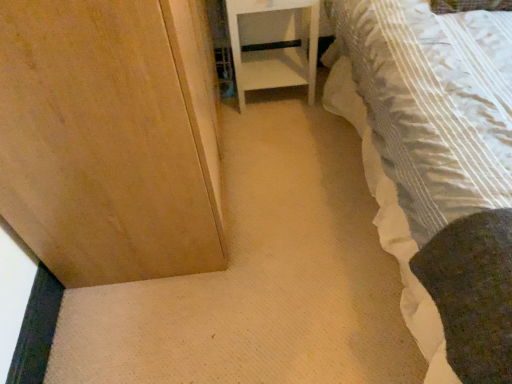
Question: Does white striped fabric bed at lower right have a greater height compared to white glossy nightstand at center?

Choices:
 (A) yes
 (B) no

Answer: (A)

Question: Can you confirm if white striped fabric bed at lower right is wider than white glossy nightstand at center?

Choices:
 (A) yes
 (B) no

Answer: (A)

Question: Is white striped fabric bed at lower right far away from white glossy nightstand at center?

Choices:
 (A) yes
 (B) no

Answer: (B)

Question: Is the position of white striped fabric bed at lower right more distant than that of white glossy nightstand at center?

Choices:
 (A) no
 (B) yes

Answer: (A)

Question: Does white striped fabric bed at lower right have a lesser width compared to white glossy nightstand at center?

Choices:
 (A) yes
 (B) no

Answer: (B)

Question: Can you confirm if white striped fabric bed at lower right is smaller than white glossy nightstand at center?

Choices:
 (A) yes
 (B) no

Answer: (B)

Question: Does white glossy nightstand at center have a greater width compared to white striped fabric bed at lower right?

Choices:
 (A) no
 (B) yes

Answer: (A)

Question: Is white glossy nightstand at center at the right side of white striped fabric bed at lower right?

Choices:
 (A) no
 (B) yes

Answer: (A)

Question: Does white glossy nightstand at center appear on the left side of white striped fabric bed at lower right?

Choices:
 (A) no
 (B) yes

Answer: (B)

Question: Does white glossy nightstand at center have a smaller size compared to white striped fabric bed at lower right?

Choices:
 (A) no
 (B) yes

Answer: (B)

Question: Is white glossy nightstand at center thinner than white striped fabric bed at lower right?

Choices:
 (A) no
 (B) yes

Answer: (B)

Question: Is white glossy nightstand at center facing towards white striped fabric bed at lower right?

Choices:
 (A) no
 (B) yes

Answer: (A)

Question: From their relative heights in the image, would you say white glossy nightstand at center is taller or shorter than white striped fabric bed at lower right?

Choices:
 (A) tall
 (B) short

Answer: (B)